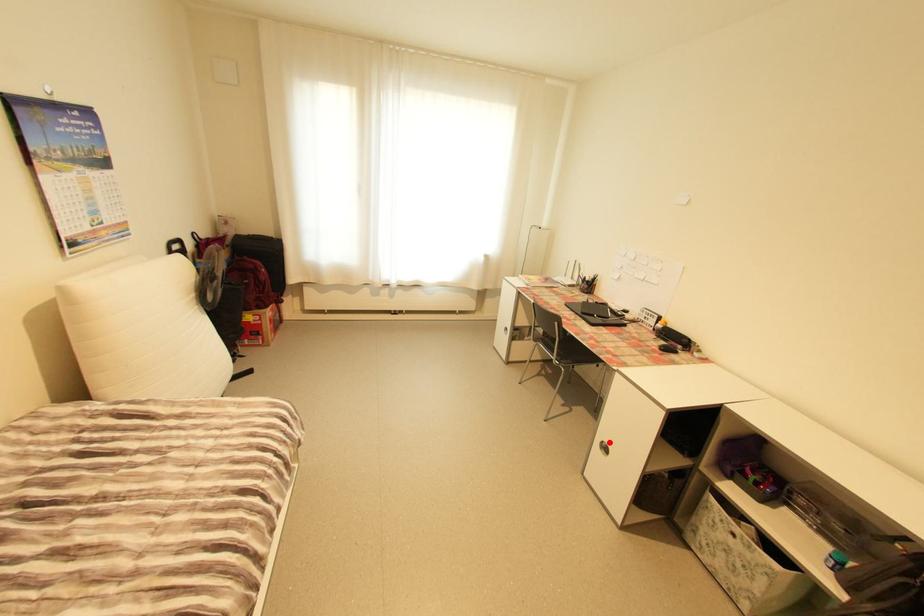
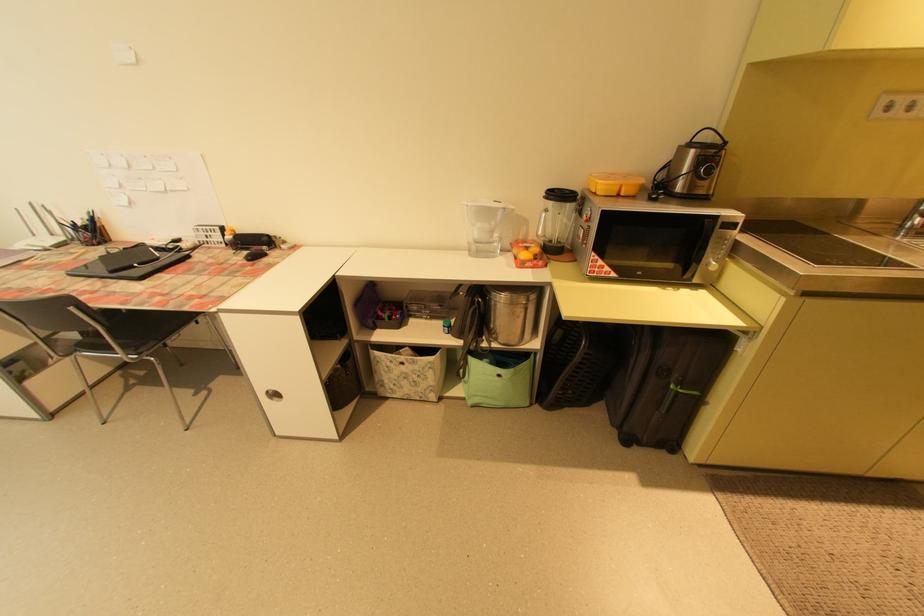
Where in the second image is the point corresponding to the highlighted location from the first image?

(274, 392)